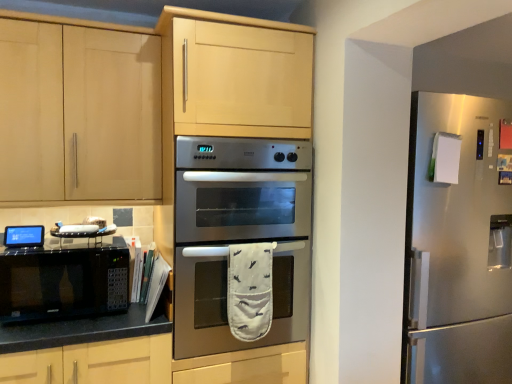
Question: Is satin silver refrigerator at right inside the boundaries of matte wood cabinet at upper left, or outside?

Choices:
 (A) inside
 (B) outside

Answer: (B)

Question: From a real-world perspective, is satin silver refrigerator at right positioned above or below matte wood cabinet at upper left?

Choices:
 (A) above
 (B) below

Answer: (B)

Question: Estimate the real-world distances between objects in this image. Which object is farther from the matte wood cabinet at upper left?

Choices:
 (A) black matte microwave at left
 (B) satin silver refrigerator at right
 (C) black matte microwave at lower left
 (D) stainless steel oven at center

Answer: (B)

Question: Estimate the real-world distances between objects in this image. Which object is closer to the satin silver refrigerator at right?

Choices:
 (A) matte wood cabinet at upper left
 (B) stainless steel oven at center
 (C) black matte microwave at left
 (D) black matte microwave at lower left

Answer: (B)